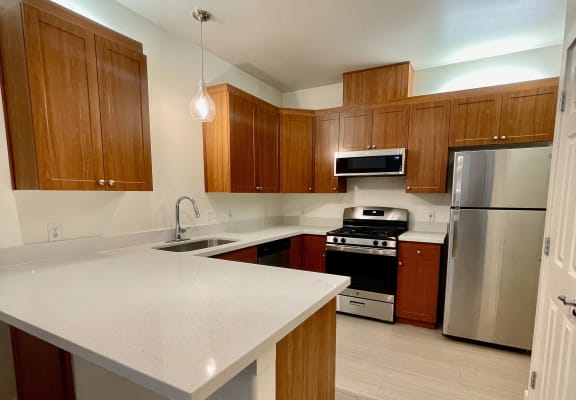
Locate an element on the screen. This screenshot has width=576, height=400. cabinet is located at coordinates (93, 113), (249, 139), (300, 141), (358, 130), (395, 128), (430, 128), (482, 124), (515, 125).